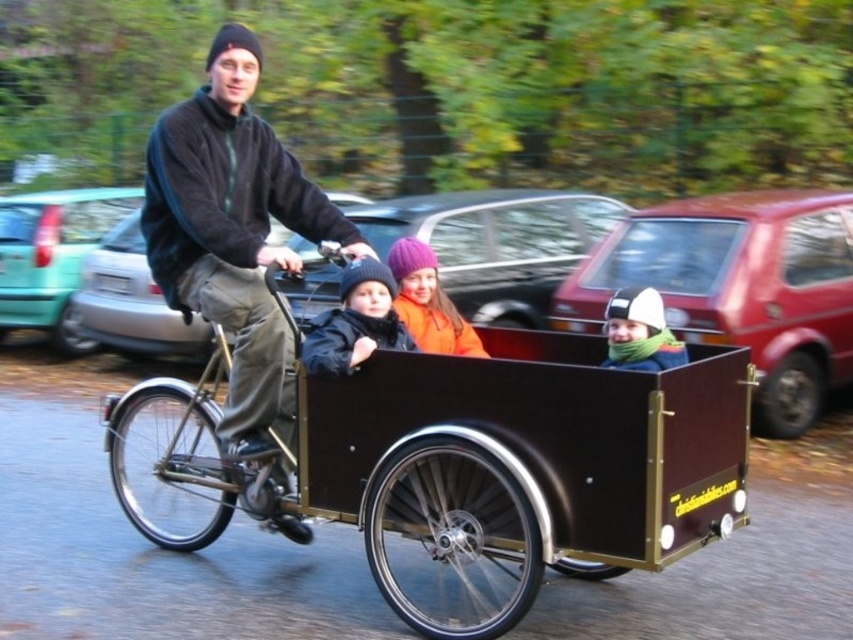
Based on the scene description, what is the 2D coordinate of the brown wooden wagon at center?

The 2D coordinate of the brown wooden wagon at center is at point [457,468].

You are a pedestrian standing on the sidewalk and see the teal matte car at left and the dark blue jacket at center. Which object is located to the left?

The teal matte car at left is positioned on the left side of dark blue jacket at center, so the teal matte car at left is located to the left.

You are a pedestrian standing at the sidewalk and see the teal matte car at left and the dark blue jacket at center in the scene. Which object is closer to you?

The teal matte car at left is closer to you because the dark blue jacket at center is behind it.